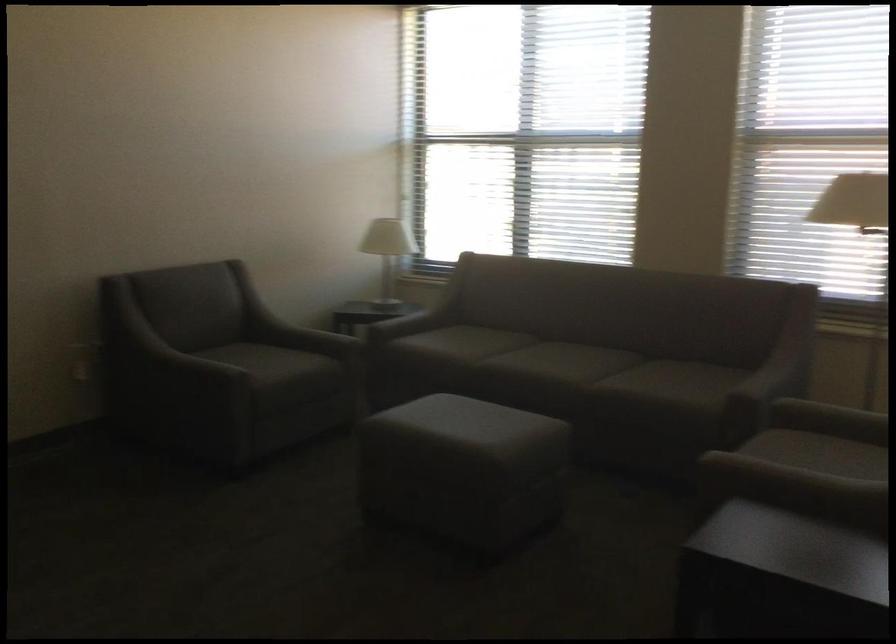
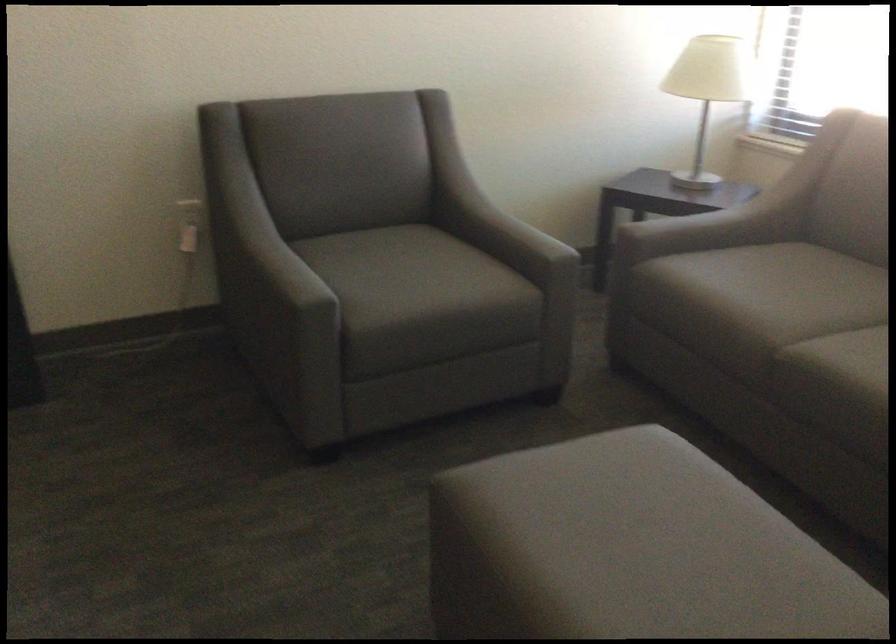
The point at [260,354] is marked in the first image. Where is the corresponding point in the second image?

(411, 263)